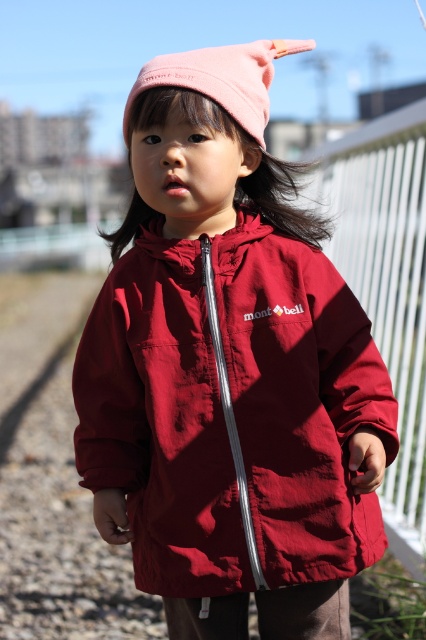
Looking at this image, you are a fashion designer observing the child in the scene. You need to determine the spatial arrangement of the burgundy fabric jacket at center and the pink fabric hat at upper center. Which object is positioned higher in the image?

The pink fabric hat at upper center is positioned higher than the burgundy fabric jacket at center.

You are a photographer trying to capture the child in the scene. Since the burgundy fabric jacket at center and the white plastic fence at right are both in the frame, which object takes up more visual space in the photo?

The white plastic fence at right takes up more visual space than the burgundy fabric jacket at center because the description states that the burgundy fabric jacket at center occupies less space than the white plastic fence at right.

You are holding a camera and want to take a photo of the white plastic fence at right. If you are standing 3 meters away from the fence, will you be able to capture the entire fence in the photo without moving closer or farther?

The distance between you and the white plastic fence at right is 3.47 meters. Since you are standing 3 meters away, you are closer than the required distance. To capture the entire fence, you should move back to the 3.47 meter mark.